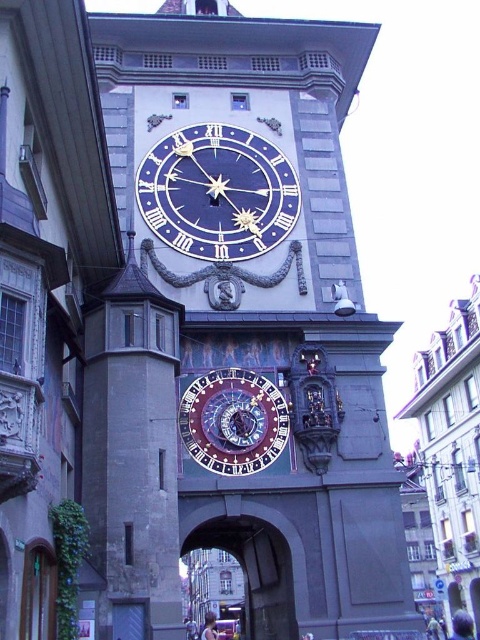
You are standing at the base of the historic clock tower. You want to take a photo of the point at coordinates (279, 387) on the tower. Your camera has a maximum zoom range of 50 meters. Can you capture the point in your photo without moving closer?

The point at coordinates (279, 387) is 45.07 meters away from the camera. Since the camera can zoom up to 50 meters, you can capture the point without moving closer.

You are an architect visiting the historic clock tower. You notice the stone clock tower at center and the polished brass clock at center. Which one is taller?

The stone clock tower at center is taller than the polished brass clock at center.

You are an architect examining the stone clock tower at center and the stone archway at center in the image. Which structure is taller?

The stone clock tower at center is taller than the stone archway at center.